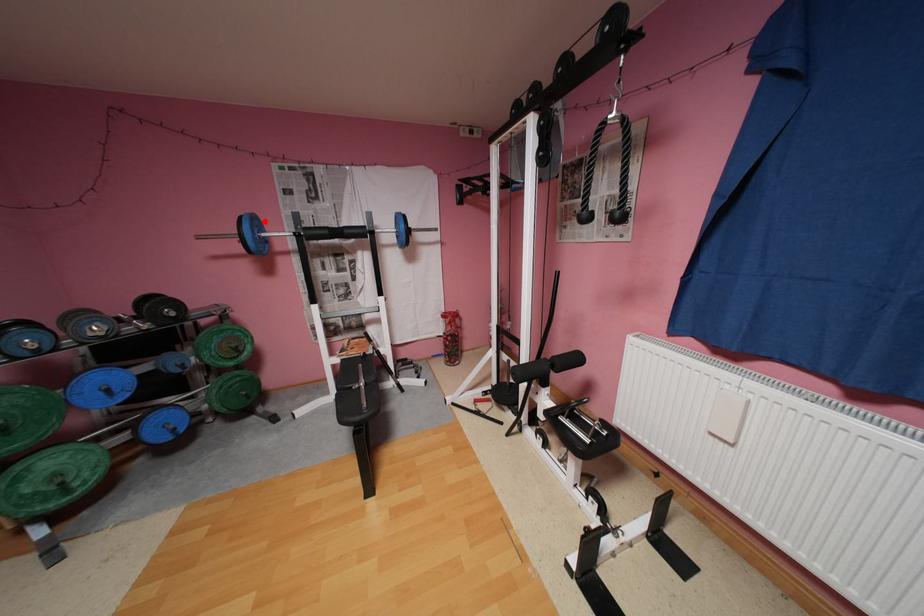
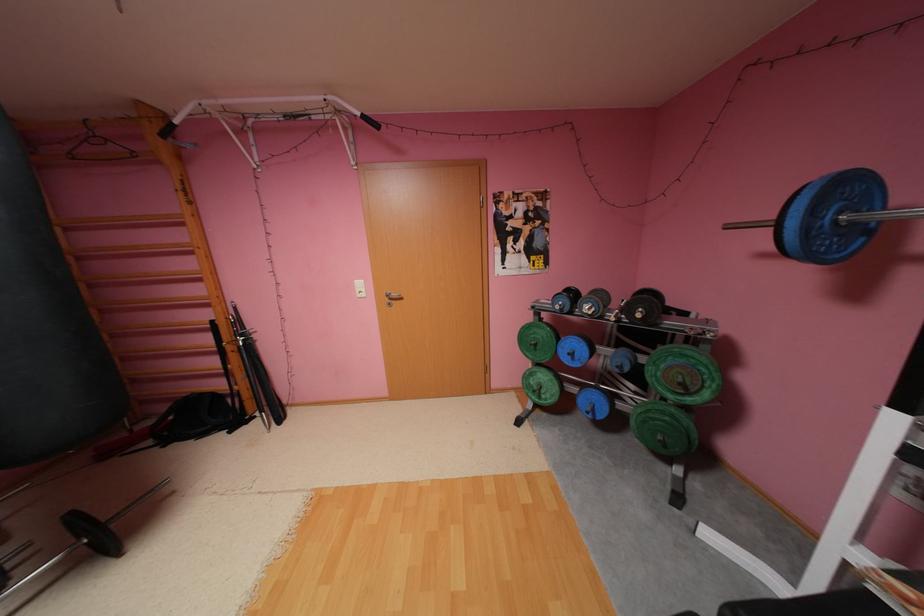
Question: I am providing you with two images of the same scene from different viewpoints. In image1, a red point is highlighted. Considering the same 3D point in image2, which of the following is correct?

Choices:
 (A) It is closer
 (B) It is farther

Answer: (B)